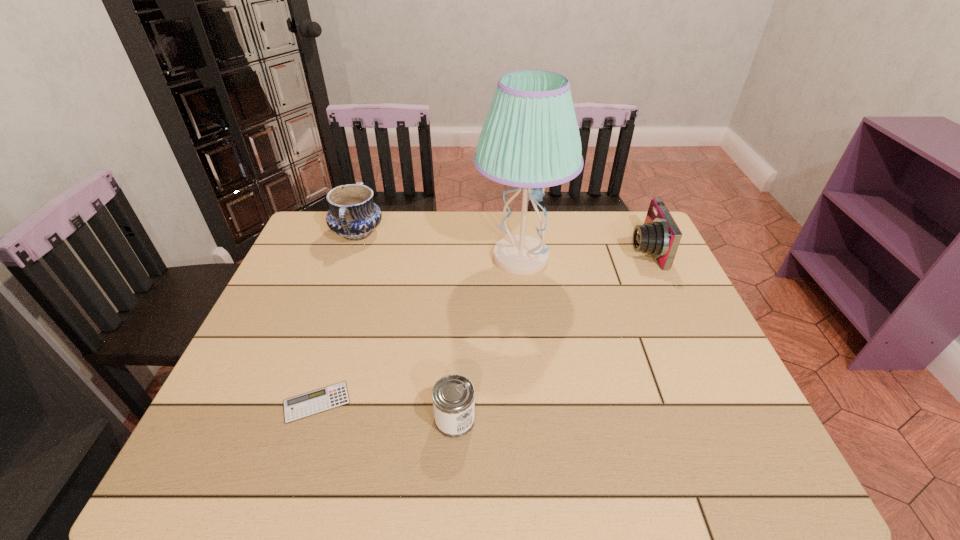
This screenshot has width=960, height=540. I want to click on empty location between the fourth tallest object and the pottery, so click(406, 326).

At what (x,y) coordinates should I click in order to perform the action: click on free spot between the camera and the can. Please return your answer as a coordinate pair (x, y). Looking at the image, I should click on (550, 335).

Locate an element on the screen. This screenshot has width=960, height=540. free space between the second shortest object and the lamp is located at coordinates (488, 339).

Image resolution: width=960 pixels, height=540 pixels. I want to click on empty space that is in between the calculator and the camera, so click(481, 326).

Find the location of `vacant point located between the fourth tallest object and the tallest object`. vacant point located between the fourth tallest object and the tallest object is located at coordinates (488, 339).

Locate an element on the screen. The height and width of the screenshot is (540, 960). object that is the second closest one to the lamp is located at coordinates (353, 215).

This screenshot has width=960, height=540. What are the coordinates of `the fourth closest object to the pottery` in the screenshot? It's located at (659, 236).

Where is `free space that satisfies the following two spatial constraints: 1. on the back side of the tallest object; 2. on the left side of the shortest object`? The height and width of the screenshot is (540, 960). free space that satisfies the following two spatial constraints: 1. on the back side of the tallest object; 2. on the left side of the shortest object is located at coordinates (363, 258).

Locate an element on the screen. The height and width of the screenshot is (540, 960). vacant space that satisfies the following two spatial constraints: 1. on the front side of the pottery; 2. on the right side of the can is located at coordinates (291, 420).

Where is `free space that satisfies the following two spatial constraints: 1. on the front-facing side of the camera; 2. on the front side of the tallest object`? Image resolution: width=960 pixels, height=540 pixels. free space that satisfies the following two spatial constraints: 1. on the front-facing side of the camera; 2. on the front side of the tallest object is located at coordinates (648, 258).